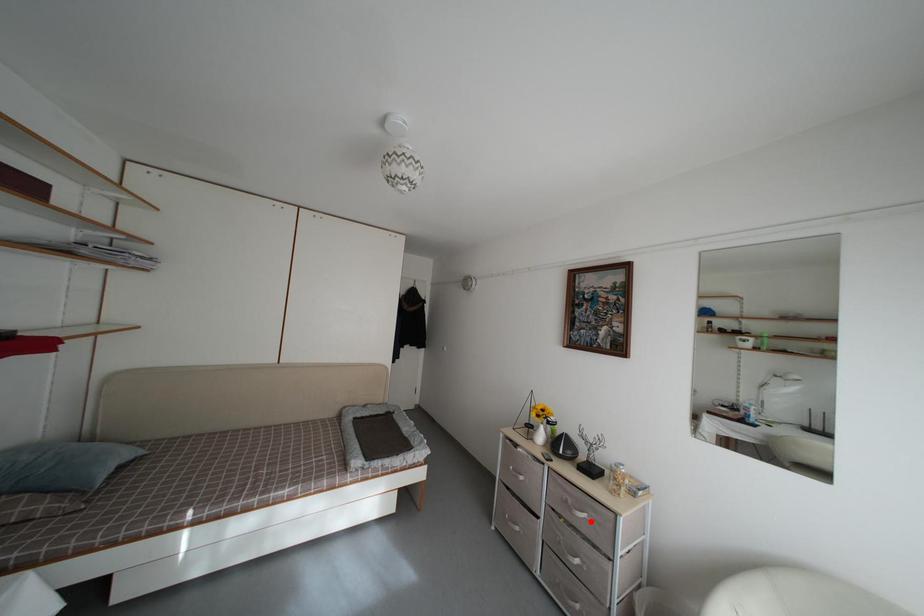
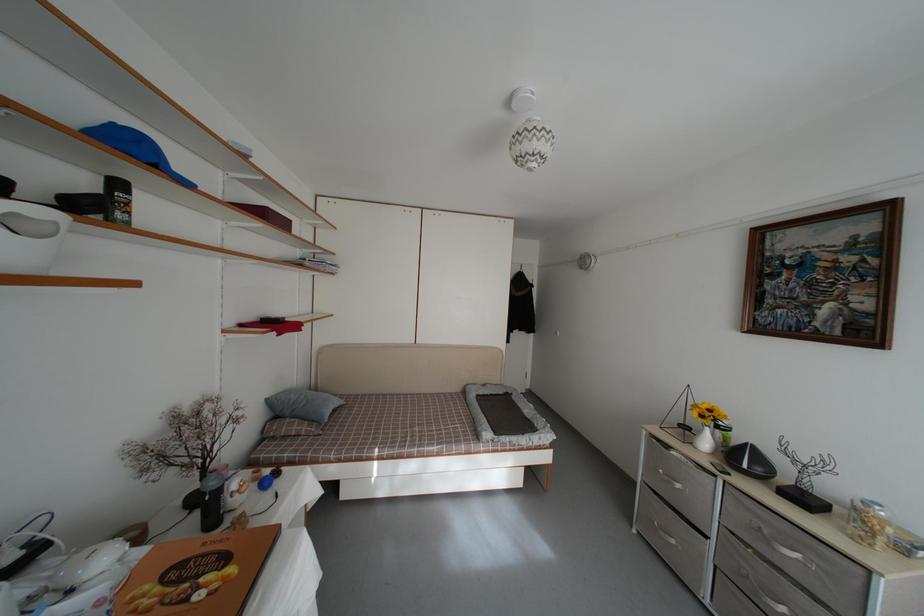
Question: A red point is marked in image1. In image2, is the corresponding 3D point closer to the camera or farther? Reply with the corresponding letter.

Choices:
 (A) The corresponding 3D point is closer.
 (B) The corresponding 3D point is farther.

Answer: (A)